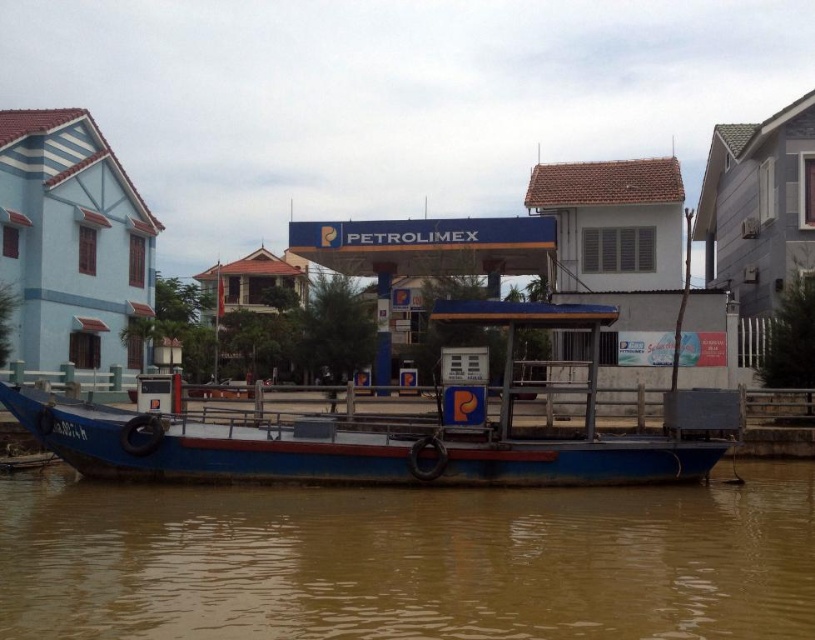
Is point (681, 625) positioned in front of point (34, 406)?

That is True.

Which is more to the right, brown muddy water at lower center or blue matte boat at center?

brown muddy water at lower center is more to the right.

This screenshot has height=640, width=815. What are the coordinates of `brown muddy water at lower center` in the screenshot? It's located at (408, 561).